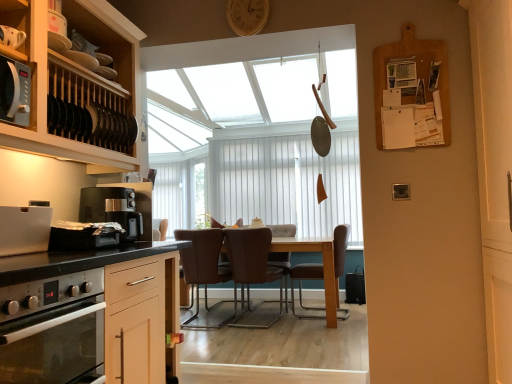
This screenshot has width=512, height=384. Identify the location of vacant space underneath brown leather chair at center, the third chair when ordered from right to left (from a real-world perspective). (210, 316).